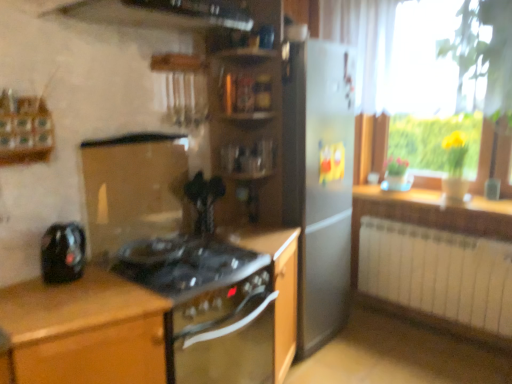
Locate an element on the screen. The width and height of the screenshot is (512, 384). yellow glass vase at right is located at coordinates (434, 141).

Where is `black glossy kettle at left`? black glossy kettle at left is located at coordinates (63, 253).

Find the location of a particular element. The height and width of the screenshot is (384, 512). black matte oven at center, which ranks as the 3th cabinetry in left-to-right order is located at coordinates (277, 285).

Identify the location of brown wood cabinet at left, the 1th cabinetry in the left-to-right sequence. The height and width of the screenshot is (384, 512). (85, 331).

The image size is (512, 384). Find the location of `yellow glass vase at right`. yellow glass vase at right is located at coordinates (434, 141).

There is a wooden countertop at right. Where is `bright above it (from a real-world perspective)`? This screenshot has width=512, height=384. bright above it (from a real-world perspective) is located at coordinates (434, 141).

Can you tell me how much yellow glass vase at right and wooden countertop at right differ in facing direction?

The facing directions of yellow glass vase at right and wooden countertop at right are 0.729 degrees apart.

Which object is positioned more to the left, yellow glass vase at right or wooden countertop at right?

Positioned to the left is wooden countertop at right.

From the picture: Which point is more forward, (274, 280) or (216, 196)?

The point (274, 280) is closer to the camera.

Could you tell me if black matte oven at center, which is the first cabinetry from right to left, is turned towards black glossy vase at center?

No, black matte oven at center, which is the first cabinetry from right to left, is not turned towards black glossy vase at center.

Considering the relative sizes of black matte oven at center, which ranks as the 3th cabinetry in left-to-right order, and black glossy vase at center in the image provided, is black matte oven at center, which ranks as the 3th cabinetry in left-to-right order, wider than black glossy vase at center?

Correct, the width of black matte oven at center, which ranks as the 3th cabinetry in left-to-right order, exceeds that of black glossy vase at center.

Is black glossy kettle at left wider than brown wood cabinet at left, the 1th cabinetry in the left-to-right sequence?

No, black glossy kettle at left is not wider than brown wood cabinet at left, the 1th cabinetry in the left-to-right sequence.

From the image's perspective, which is above, black glossy kettle at left or brown wood cabinet at left, the 3th cabinetry in the right-to-left sequence?

black glossy kettle at left appears higher in the image.

How many degrees apart are the facing directions of black glossy kettle at left and brown wood cabinet at left, the 3th cabinetry in the right-to-left sequence?

0.487 degrees separate the facing orientations of black glossy kettle at left and brown wood cabinet at left, the 3th cabinetry in the right-to-left sequence.

Would you say black glossy kettle at left is outside brown wood cabinet at left, the 3th cabinetry in the right-to-left sequence?

That's correct, black glossy kettle at left is outside of brown wood cabinet at left, the 3th cabinetry in the right-to-left sequence.

From a real-world perspective, who is located lower, black matte oven at center, which ranks as the 3th cabinetry in left-to-right order, or yellow glass vase at right?

black matte oven at center, which ranks as the 3th cabinetry in left-to-right order, is physically lower.

From the image's perspective, who appears lower, black matte oven at center, which ranks as the 3th cabinetry in left-to-right order, or yellow glass vase at right?

black matte oven at center, which ranks as the 3th cabinetry in left-to-right order, from the image's perspective.

Does black matte oven at center, which is the first cabinetry from right to left, turn towards yellow glass vase at right?

No, black matte oven at center, which is the first cabinetry from right to left, is not turned towards yellow glass vase at right.

Would you say yellow glass vase at right is part of black matte oven at center, which ranks as the 3th cabinetry in left-to-right order,'s contents?

Actually, yellow glass vase at right is outside black matte oven at center, which ranks as the 3th cabinetry in left-to-right order.

From a real-world perspective, which is physically below, black glass stove at center, which is the 2th cabinetry from left to right, or wooden shelves at center?

In real-world perspective, black glass stove at center, which is the 2th cabinetry from left to right, is lower.

This screenshot has height=384, width=512. There is a wooden shelves at center. What are the coordinates of `the 3rd cabinetry below it (from the image's perspective)` in the screenshot? It's located at (97, 329).

Who is more distant, black glass stove at center, which is the 2th cabinetry from left to right, or wooden shelves at center?

wooden shelves at center is more distant.

From the image's perspective, is black glass stove at center, which is the 2th cabinetry from left to right, under wooden shelves at center?

Indeed, from the image's perspective, black glass stove at center, which is the 2th cabinetry from left to right, is shown beneath wooden shelves at center.

Is black glossy kettle at left inside or outside of wooden shelves at center?

black glossy kettle at left is not enclosed by wooden shelves at center.

Are black glossy kettle at left and wooden shelves at center making contact?

black glossy kettle at left and wooden shelves at center are clearly separated.

Measure the distance between black glossy kettle at left and wooden shelves at center.

black glossy kettle at left is 1.07 meters from wooden shelves at center.

Does black glossy kettle at left have a greater width compared to wooden shelves at center?

In fact, black glossy kettle at left might be narrower than wooden shelves at center.

Between black glossy vase at center and black glass stove at center, which is the 2th cabinetry from left to right, which one has more height?

black glass stove at center, which is the 2th cabinetry from left to right.

In order to click on appliance that is on the right side of black glass stove at center, placed as the second cabinetry when sorted from right to left in this screenshot , I will do `click(204, 201)`.

Is black glossy vase at center looking in the opposite direction of black glass stove at center, placed as the second cabinetry when sorted from right to left?

No.

Could you measure the distance between black glossy vase at center and black glass stove at center, placed as the second cabinetry when sorted from right to left?

They are 25.13 inches apart.

Find the location of `bright above the wooden countertop at right (from the image's perspective)`. bright above the wooden countertop at right (from the image's perspective) is located at coordinates (434, 141).

Where is `cabinetry that is the 1st one when counting downward from the black glossy vase at center (from the image's perspective)`? cabinetry that is the 1st one when counting downward from the black glossy vase at center (from the image's perspective) is located at coordinates (277, 285).

From the image, which object appears to be farther from brown wood cabinet at left, the 3th cabinetry in the right-to-left sequence, black matte oven at center, which is the first cabinetry from right to left, or black glossy vase at center?

Based on the image, black glossy vase at center appears to be further to brown wood cabinet at left, the 3th cabinetry in the right-to-left sequence.

Considering their positions, is black glossy vase at center positioned further to black matte oven at center, which ranks as the 3th cabinetry in left-to-right order, than black glass gas stove at center?

black glossy vase at center.

Based on their spatial positions, is black glossy vase at center or brown wood cabinet at left, the 1th cabinetry in the left-to-right sequence, further from white metallic radiator at lower right?

brown wood cabinet at left, the 1th cabinetry in the left-to-right sequence, lies further to white metallic radiator at lower right than the other object.

Which object lies nearer to the anchor point wooden shelves at center, wooden countertop at right or black glass stove at center, which is the 2th cabinetry from left to right?

Based on the image, black glass stove at center, which is the 2th cabinetry from left to right, appears to be nearer to wooden shelves at center.

From the image, which object appears to be farther from white metallic radiator at lower right, black glass gas stove at center or black matte oven at center, which is the first cabinetry from right to left?

black glass gas stove at center.

When comparing their distances from wooden countertop at right, does yellow glass vase at right or brown wood cabinet at left, the 3th cabinetry in the right-to-left sequence, seem further?

The object further to wooden countertop at right is brown wood cabinet at left, the 3th cabinetry in the right-to-left sequence.

Considering their positions, is white metallic radiator at lower right positioned closer to wooden shelves at center than black glossy kettle at left?

Among the two, black glossy kettle at left is located nearer to wooden shelves at center.

When comparing their distances from brown wood cabinet at left, the 3th cabinetry in the right-to-left sequence, does white metallic radiator at lower right or black glass stove at center, which is the 2th cabinetry from left to right, seem further?

white metallic radiator at lower right is further to brown wood cabinet at left, the 3th cabinetry in the right-to-left sequence.

At what (x,y) coordinates should I click in order to perform the action: click on gas stove between black glossy kettle at left and wooden shelves at center from left to right. Please return your answer as a coordinate pair (x, y). Image resolution: width=512 pixels, height=384 pixels. Looking at the image, I should click on (186, 264).

Find the location of a particular element. The width and height of the screenshot is (512, 384). radiator between wooden shelves at center and wooden countertop at right in the horizontal direction is located at coordinates (438, 273).

The image size is (512, 384). What are the coordinates of `shelf located between black glass gas stove at center and wooden countertop at right in the left-right direction` in the screenshot? It's located at (247, 115).

Where is `cabinetry between wooden shelves at center and white metallic radiator at lower right`? The image size is (512, 384). cabinetry between wooden shelves at center and white metallic radiator at lower right is located at coordinates (277, 285).